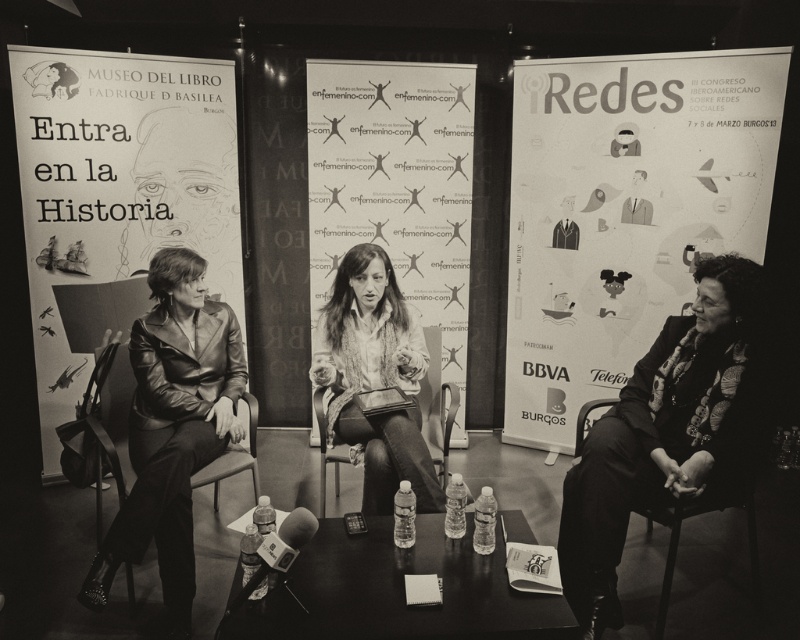
You are a photographer standing in front of the scene. You need to take a photo that includes both the matte paper poster at right and the leather jacket at center. Which object should you position closer to the camera to ensure both are fully visible in the frame?

The matte paper poster at right is much taller than the leather jacket at center, so to include both fully in the frame, position the leather jacket at center closer to the camera. This way, the taller poster can be captured without cropping while keeping the jacket in focus.